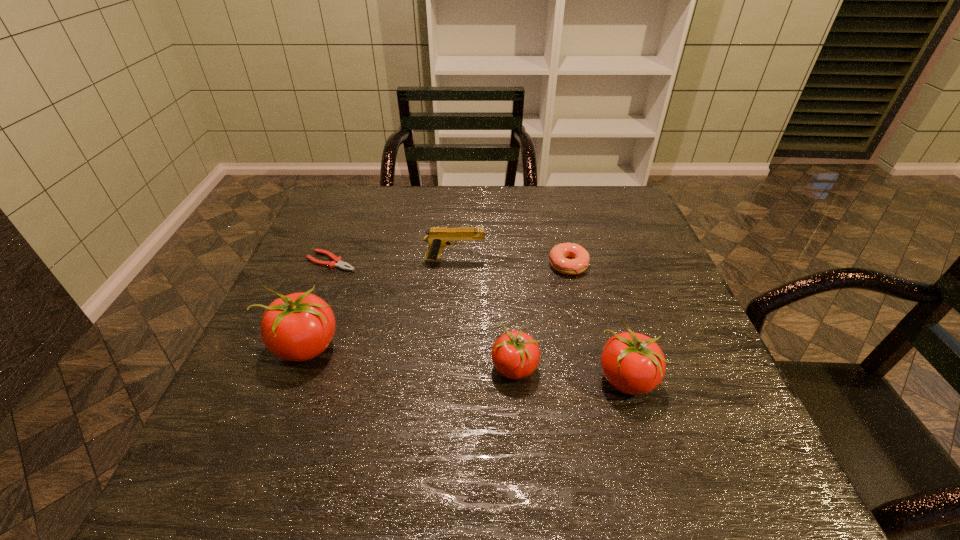
In the image, there is a desktop. Find the location of `blank space at the left edge`. blank space at the left edge is located at coordinates (339, 319).

I want to click on free space at the right edge, so click(623, 267).

In the image, there is a desktop. Identify the location of vacant space at the far left corner. Image resolution: width=960 pixels, height=540 pixels. (332, 204).

You are a GUI agent. You are given a task and a screenshot of the screen. Output one action in this format:
    pyautogui.click(x=<x>, y=<y>)
    Task: Click on the vacant space at the far right corner
    
    Given the screenshot: What is the action you would take?
    pyautogui.click(x=620, y=193)

In the image, there is a desktop. What are the coordinates of `vacant area at the near right corner` in the screenshot? It's located at (696, 411).

This screenshot has width=960, height=540. Find the location of `vacant region between the second shortest tomato and the fourth object from right to left`. vacant region between the second shortest tomato and the fourth object from right to left is located at coordinates (540, 319).

At what (x,y) coordinates should I click in order to perform the action: click on vacant area between the pistol and the third object from right to left. Please return your answer as a coordinate pair (x, y). Image resolution: width=960 pixels, height=540 pixels. Looking at the image, I should click on (485, 314).

Where is `free space between the doughnut and the second tallest tomato`? free space between the doughnut and the second tallest tomato is located at coordinates (597, 322).

Locate an element on the screen. free space between the doughnut and the second shortest tomato is located at coordinates (597, 322).

Identify the location of free spot between the rightmost tomato and the shortest tomato. The width and height of the screenshot is (960, 540). (570, 373).